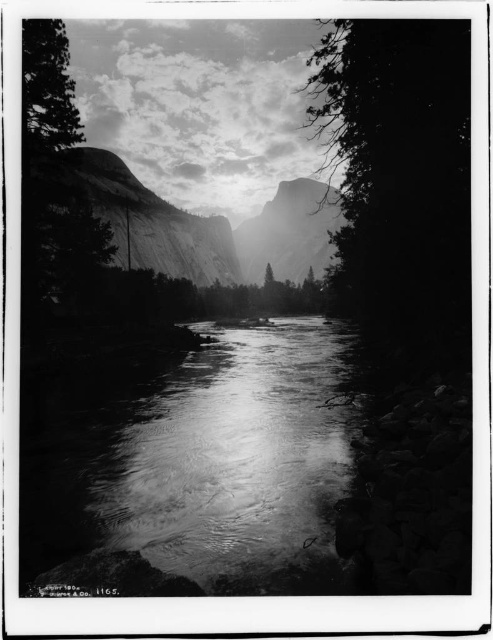
Question: Which point appears farthest from the camera in this image?

Choices:
 (A) (22, 74)
 (B) (166, 250)
 (C) (245, 436)

Answer: (B)

Question: Can you confirm if smooth granite mountain at center is positioned above smooth bark tree at left?

Choices:
 (A) yes
 (B) no

Answer: (A)

Question: Can you confirm if smooth water at center is smaller than smooth bark tree at left?

Choices:
 (A) no
 (B) yes

Answer: (A)

Question: Which of the following is the closest to the observer?

Choices:
 (A) smooth bark tree at left
 (B) smooth granite mountain at center

Answer: (A)

Question: Which of the following is the closest to the observer?

Choices:
 (A) click(x=182, y=426)
 (B) click(x=72, y=157)
 (C) click(x=308, y=196)
 (D) click(x=44, y=104)

Answer: (A)

Question: Is smooth water at center bigger than granite rock formation at center?

Choices:
 (A) yes
 (B) no

Answer: (B)